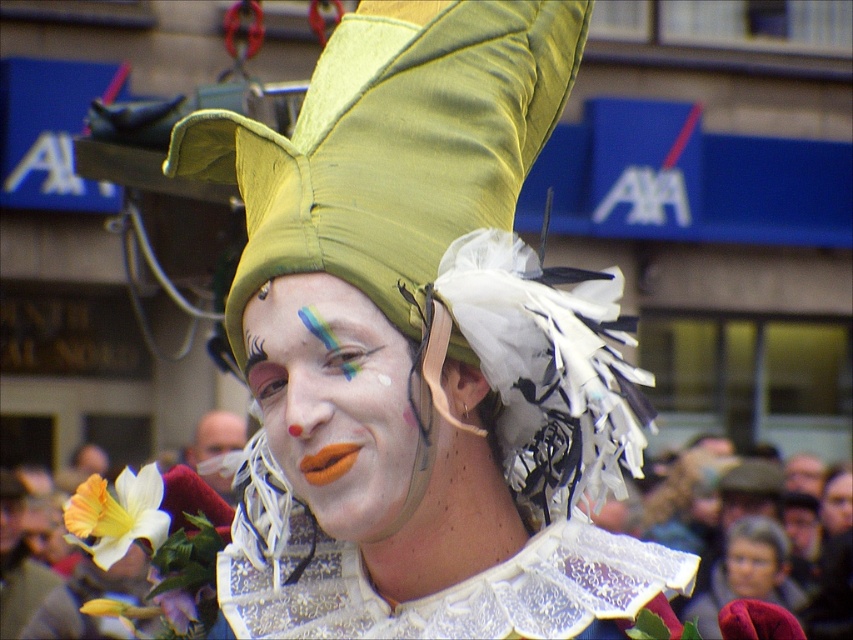
Question: Can you confirm if matte green hat at center is bigger than smooth black hair at center?

Choices:
 (A) yes
 (B) no

Answer: (A)

Question: Is matte white face at center further to the viewer compared to matte white face paint at center?

Choices:
 (A) yes
 (B) no

Answer: (B)

Question: Considering the real-world distances, which object is farthest from the matte white face paint at center?

Choices:
 (A) matte white face at center
 (B) smooth skin face at center

Answer: (A)

Question: From the image, what is the correct spatial relationship of matte black face at lower right in relation to smooth black hair at center?

Choices:
 (A) above
 (B) below

Answer: (B)

Question: Which point is closer to the camera?

Choices:
 (A) (393, 500)
 (B) (824, 486)
 (C) (756, 588)
 (D) (210, 426)

Answer: (A)

Question: Which object is farther from the camera taking this photo?

Choices:
 (A) matte white face at center
 (B) matte black face at lower right
 (C) matte green hat at center
 (D) matte white face paint at center

Answer: (D)